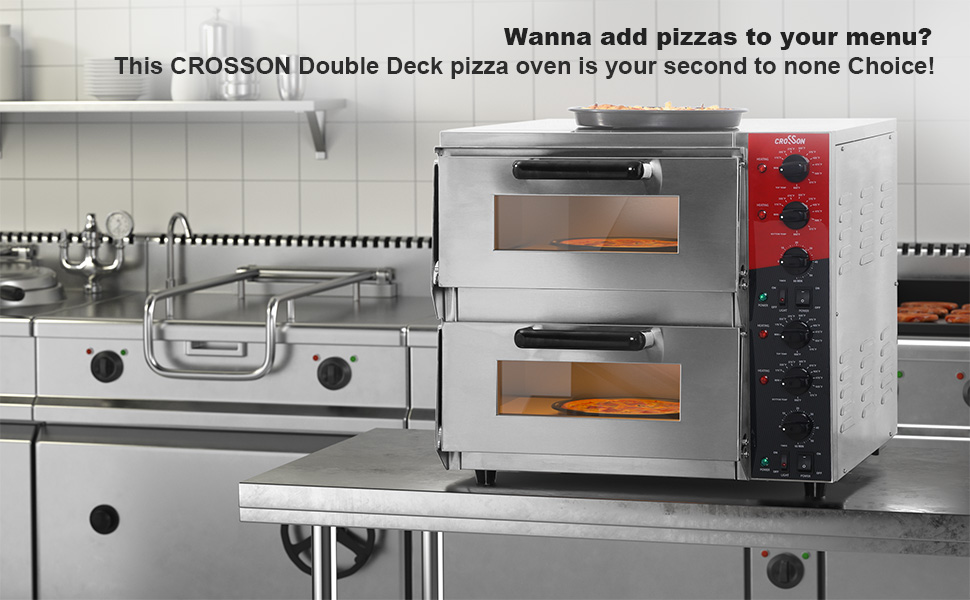
Locate an element on the screen. The image size is (970, 600). table is located at coordinates (900, 497).